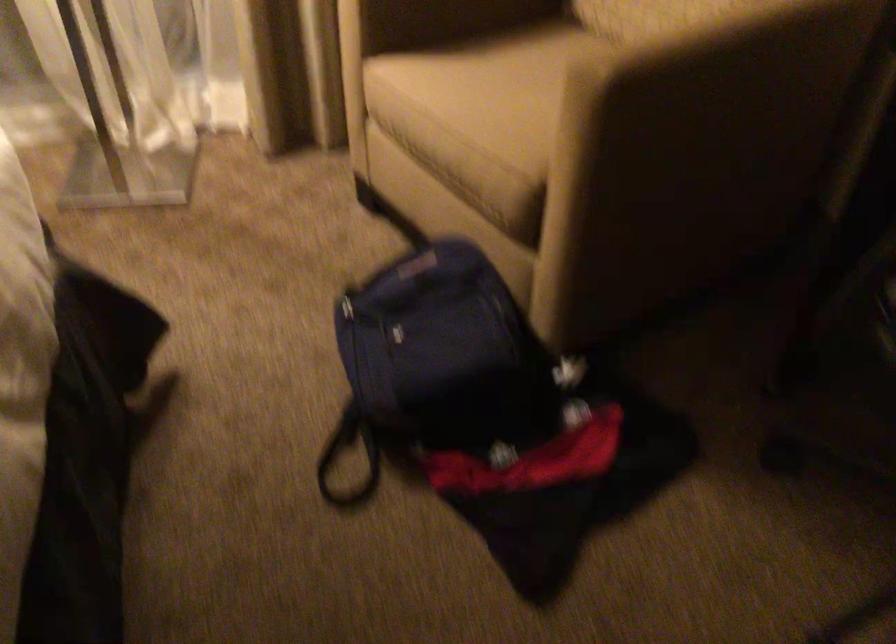
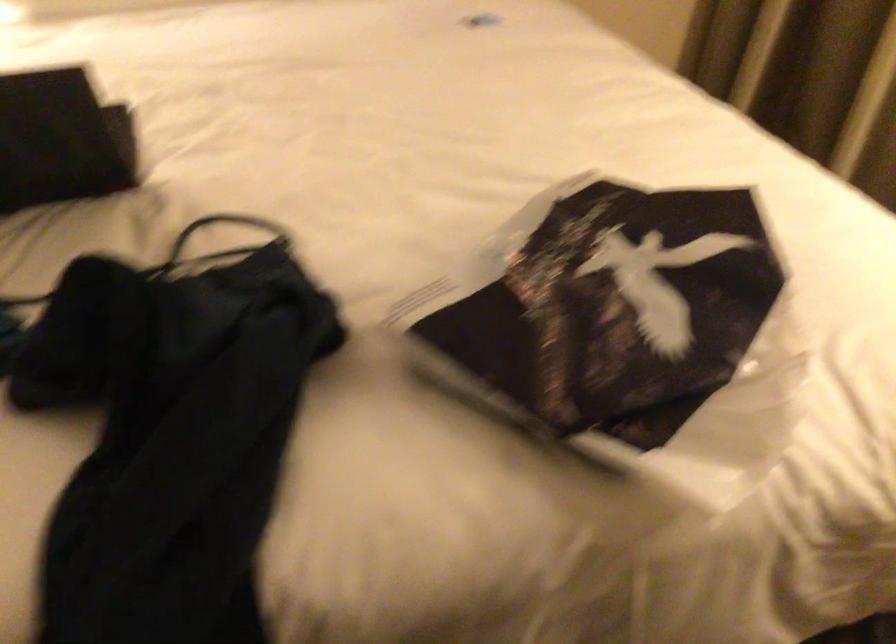
The images are taken continuously from a first-person perspective. In which direction is your viewpoint rotating?

The camera's rotation is toward left-down.